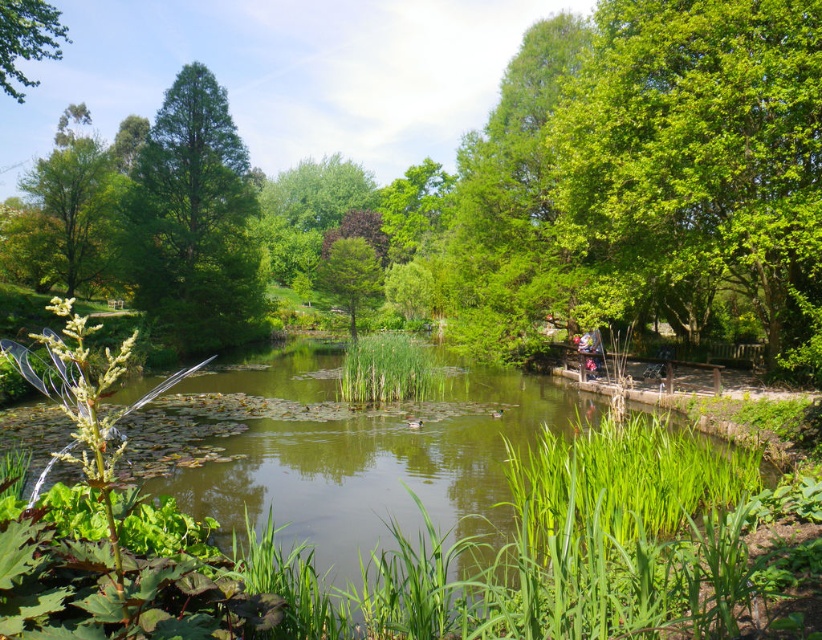
You are planning to install a small wooden bench between the green leafy tree at left and the green matte tree at center. The bench requires a minimum of 15 meters of space between the two trees to be placed comfortably. Can you place the bench there?

The green leafy tree at left and green matte tree at center are 20.89 meters apart from each other, which is more than the required 15 meters. Therefore, the bench can be placed comfortably between them.

You are standing in the natural scene and want to take a photo of both the green leafy tree at upper left and the green matte tree at center. Which tree should you position to your left side to include both in the frame?

You should position the green leafy tree at upper left to your left side because it is already to the left of the green matte tree at center in the scene.

You are a bird flying over the natural scene described. You see the green leafy tree at left and the green matte tree at center. Which tree would you land on first if you are flying from the top of the image downwards?

The green leafy tree at left is located above the green matte tree at center, so you would land on the green leafy tree at left first when flying downwards from the top of the image.